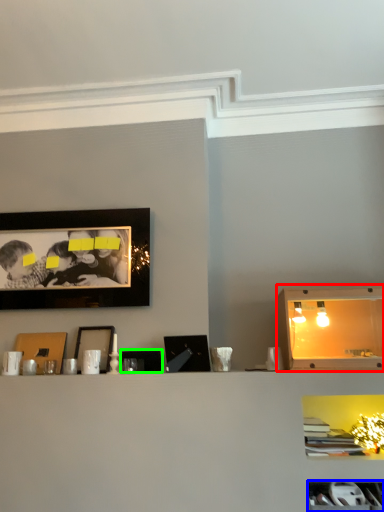
Question: Estimate the real-world distances between objects in this image. Which object is closer to cabinet (highlighted by a red box), cabinet (highlighted by a blue box) or picture frame (highlighted by a green box)?

Choices:
 (A) cabinet
 (B) picture frame

Answer: (A)